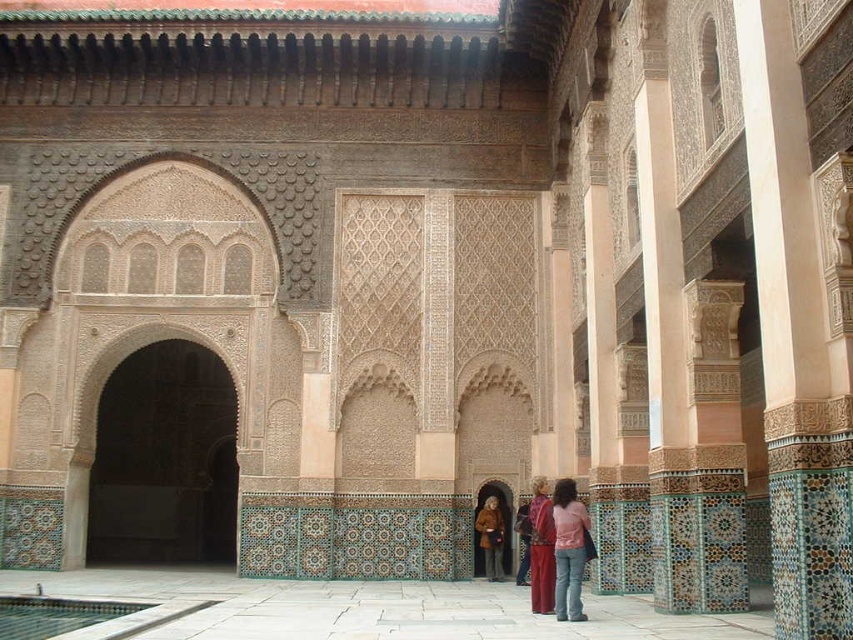
Measure the distance between point (x=54, y=605) and camera.

Point (x=54, y=605) is 41.61 meters away from camera.

Does clear glass pool at lower left appear under matte red dress at lower center?

Indeed, clear glass pool at lower left is positioned under matte red dress at lower center.

Does point (3, 595) come farther from viewer compared to point (550, 600)?

That is True.

You are a GUI agent. You are given a task and a screenshot of the screen. Output one action in this format:
    pyautogui.click(x=<x>, y=<y>)
    Task: Click on the clear glass pool at lower left
    
    Given the screenshot: What is the action you would take?
    pyautogui.click(x=57, y=614)

Does pink fabric at lower center have a greater height compared to matte red dress at lower center?

No.

Describe the element at coordinates (567, 548) in the screenshot. I see `pink fabric at lower center` at that location.

What do you see at coordinates (567, 548) in the screenshot? I see `pink fabric at lower center` at bounding box center [567, 548].

The height and width of the screenshot is (640, 853). In order to click on pink fabric at lower center in this screenshot , I will do `click(567, 548)`.

Which is more to the left, clear glass pool at lower left or brown leather jacket at center?

Positioned to the left is clear glass pool at lower left.

Does clear glass pool at lower left have a larger size compared to brown leather jacket at center?

Correct, clear glass pool at lower left is larger in size than brown leather jacket at center.

Between point (88, 604) and point (498, 522), which one is positioned in front?

Point (88, 604) is more forward.

This screenshot has height=640, width=853. What are the coordinates of `clear glass pool at lower left` in the screenshot? It's located at [57, 614].